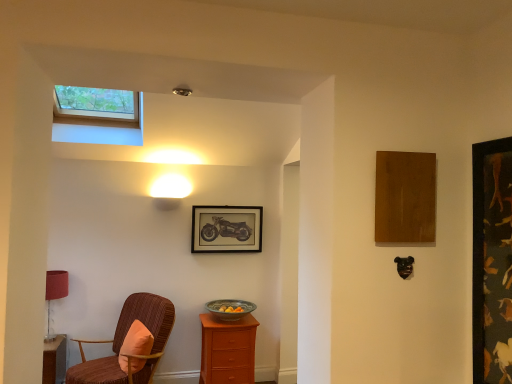
This screenshot has width=512, height=384. What are the coordinates of `vacant point above matte black motorcycle at center, acting as the second picture frame starting from the front (from a real-world perspective)` in the screenshot? It's located at [x=225, y=208].